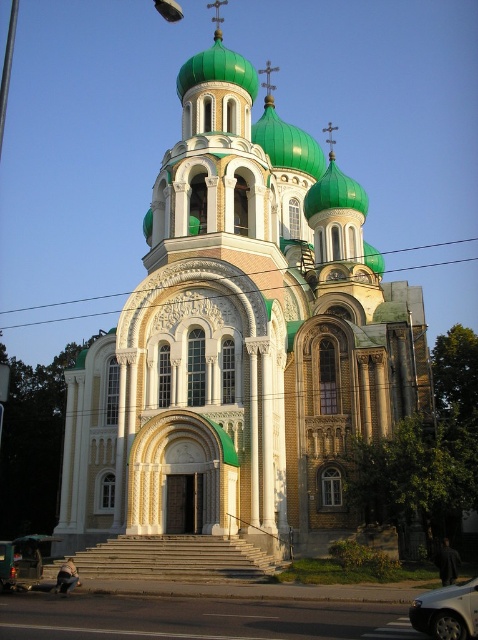
Question: Which point is closer to the camera taking this photo?

Choices:
 (A) (433, 620)
 (B) (76, 381)

Answer: (A)

Question: Can you confirm if white stone church at center is positioned to the right of white glossy car at lower right?

Choices:
 (A) yes
 (B) no

Answer: (B)

Question: In this image, where is white stone church at center located relative to white glossy car at lower right?

Choices:
 (A) left
 (B) right

Answer: (A)

Question: Is white stone church at center to the left of white glossy car at lower right from the viewer's perspective?

Choices:
 (A) no
 (B) yes

Answer: (B)

Question: Which object is farther from the camera taking this photo?

Choices:
 (A) white stone church at center
 (B) white glossy car at lower right

Answer: (A)